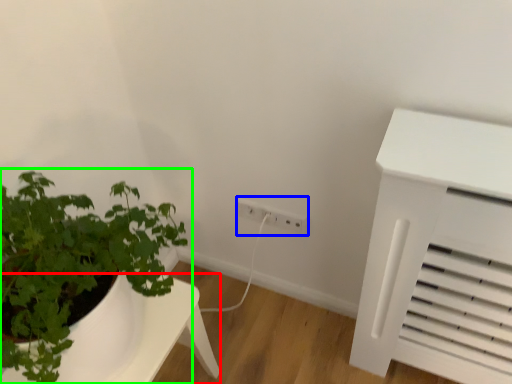
Question: Considering the real-world distances, which object is closest to table (highlighted by a red box)? electric outlet (highlighted by a blue box) or houseplant (highlighted by a green box).

Choices:
 (A) electric outlet
 (B) houseplant

Answer: (B)